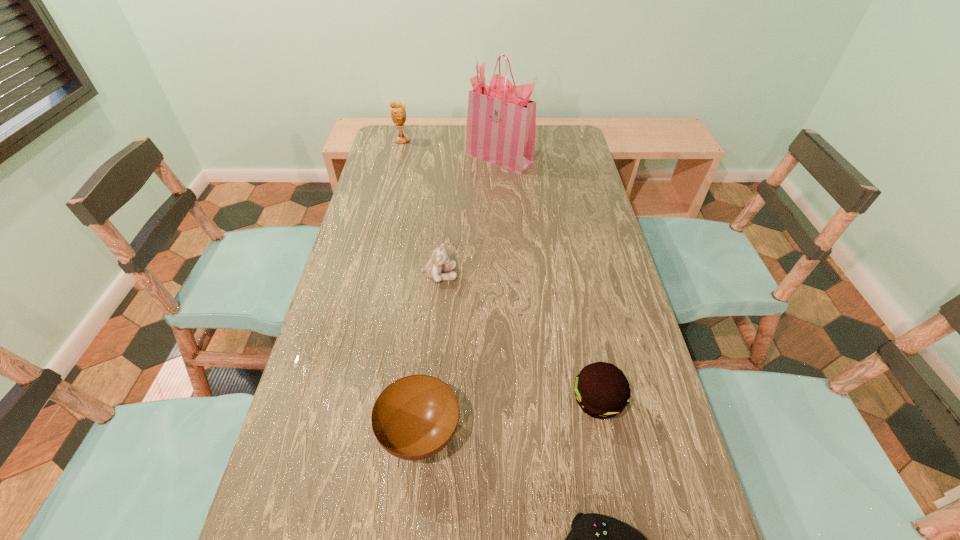
Image resolution: width=960 pixels, height=540 pixels. What are the coordinates of `shopping bag` in the screenshot? It's located at (501, 122).

Locate an element on the screen. Image resolution: width=960 pixels, height=540 pixels. the leftmost object is located at coordinates (397, 109).

You are a GUI agent. You are given a task and a screenshot of the screen. Output one action in this format:
    pyautogui.click(x=<x>, y=<y>)
    Task: Click on the chalice
    
    Given the screenshot: What is the action you would take?
    pyautogui.click(x=397, y=109)

Where is `the third farthest object`? The width and height of the screenshot is (960, 540). the third farthest object is located at coordinates (438, 263).

Identify the location of patty. (602, 391).

Identify the location of bowl. The image size is (960, 540). (415, 417).

The width and height of the screenshot is (960, 540). Find the location of `blank space located on the left of the tallest object`. blank space located on the left of the tallest object is located at coordinates (402, 157).

You are a GUI agent. You are given a task and a screenshot of the screen. Output one action in this format:
    pyautogui.click(x=<x>, y=<y>)
    Task: Click on the vacant space situated 0.060m on the left of the leftmost object
    The height and width of the screenshot is (540, 960).
    Given the screenshot: What is the action you would take?
    pyautogui.click(x=379, y=140)

At what (x,y) coordinates should I click in order to perform the action: click on vacant space located on the face of the teddy bear. Please return your answer as a coordinate pair (x, y). This screenshot has height=540, width=960. Looking at the image, I should click on tap(595, 275).

Image resolution: width=960 pixels, height=540 pixels. In order to click on free region located on the back of the patty in this screenshot , I will do `click(571, 272)`.